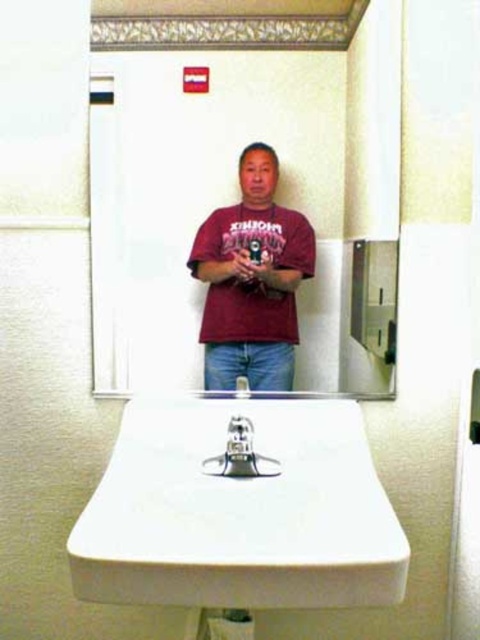
Question: Is white glossy sink at lower center bigger than maroon cotton t-shirt at center?

Choices:
 (A) yes
 (B) no

Answer: (A)

Question: Can you confirm if matte maroon shirt at center is positioned above maroon cotton t-shirt at center?

Choices:
 (A) no
 (B) yes

Answer: (B)

Question: Estimate the real-world distances between objects in this image. Which object is farther from the satin nickel faucet at center?

Choices:
 (A) matte maroon shirt at center
 (B) white glossy sink at lower center
 (C) maroon cotton t-shirt at center

Answer: (A)

Question: Which of the following is the closest to the observer?

Choices:
 (A) white glossy sink at lower center
 (B) matte maroon shirt at center
 (C) maroon cotton t-shirt at center

Answer: (A)

Question: Which point is closer to the camera?

Choices:
 (A) maroon cotton t-shirt at center
 (B) satin nickel faucet at center
 (C) white glossy sink at lower center

Answer: (C)

Question: Does matte maroon shirt at center appear on the right side of maroon cotton t-shirt at center?

Choices:
 (A) no
 (B) yes

Answer: (B)